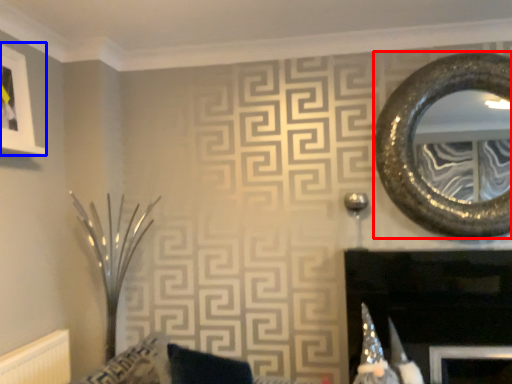
Question: Which object is further to the camera taking this photo, oval (highlighted by a red box) or picture frame (highlighted by a blue box)?

Choices:
 (A) oval
 (B) picture frame

Answer: (A)